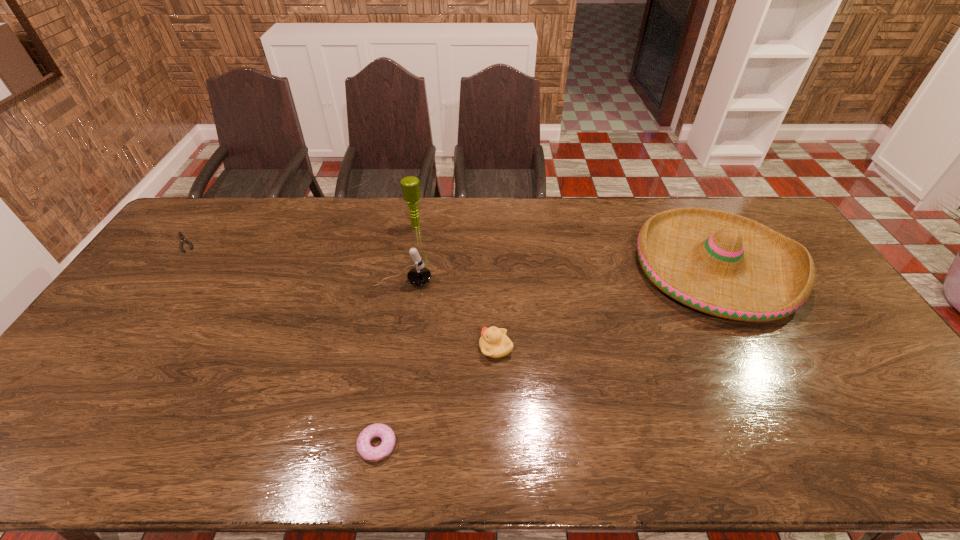
Identify which object is the third closest to the nearer microphone. Please provide its 2D coordinates. Your answer should be formatted as a tuple, i.e. [(x, y)], where the tuple contains the x and y coordinates of a point satisfying the conditions above.

[(372, 454)]

Locate an element on the screen. The image size is (960, 540). vacant space that satisfies the following two spatial constraints: 1. on the back side of the second shortest object; 2. on the left side of the taller microphone is located at coordinates (414, 226).